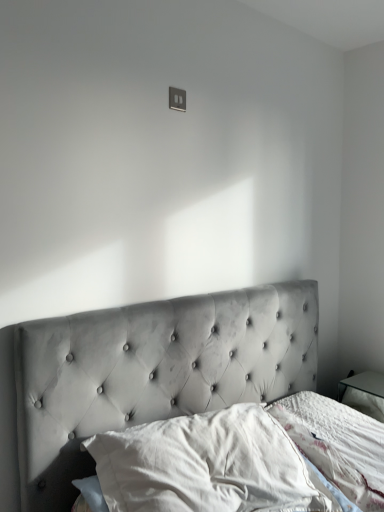
Question: Considering the positions of white soft pillow at lower center and matte gray switch at upper center in the image, is white soft pillow at lower center bigger or smaller than matte gray switch at upper center?

Choices:
 (A) small
 (B) big

Answer: (B)

Question: From a real-world perspective, is white soft pillow at lower center physically located above or below matte gray switch at upper center?

Choices:
 (A) below
 (B) above

Answer: (A)

Question: Would you say white soft pillow at lower center is to the left or to the right of matte gray switch at upper center in the picture?

Choices:
 (A) left
 (B) right

Answer: (B)

Question: Based on their positions, is matte gray switch at upper center located to the left or right of white soft pillow at lower center?

Choices:
 (A) right
 (B) left

Answer: (B)

Question: Is matte gray switch at upper center situated inside white soft pillow at lower center or outside?

Choices:
 (A) inside
 (B) outside

Answer: (B)

Question: Looking at the image, does matte gray switch at upper center seem bigger or smaller compared to white soft pillow at lower center?

Choices:
 (A) small
 (B) big

Answer: (A)

Question: Is matte gray switch at upper center taller or shorter than white soft pillow at lower center?

Choices:
 (A) short
 (B) tall

Answer: (A)